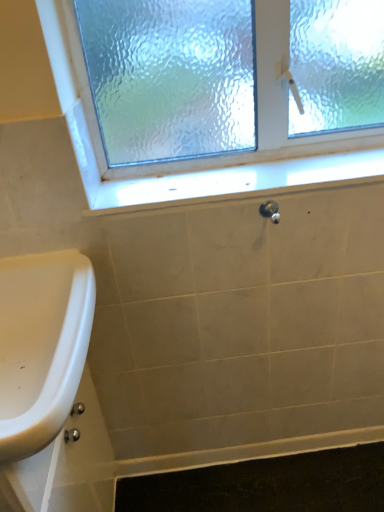
Question: Is frosted glass window at upper center at the back of white glossy sink at lower left?

Choices:
 (A) yes
 (B) no

Answer: (B)

Question: Would you say white glossy sink at lower left is outside frosted glass window at upper center?

Choices:
 (A) yes
 (B) no

Answer: (A)

Question: From a real-world perspective, does white glossy sink at lower left sit lower than frosted glass window at upper center?

Choices:
 (A) no
 (B) yes

Answer: (B)

Question: Can you confirm if white glossy sink at lower left is bigger than frosted glass window at upper center?

Choices:
 (A) no
 (B) yes

Answer: (A)

Question: Does white glossy sink at lower left have a lesser width compared to frosted glass window at upper center?

Choices:
 (A) yes
 (B) no

Answer: (B)

Question: From a real-world perspective, is satin nickel knob at center physically located above or below white glossy sink at lower left?

Choices:
 (A) below
 (B) above

Answer: (B)

Question: Is point (279, 219) closer or farther from the camera than point (57, 266)?

Choices:
 (A) farther
 (B) closer

Answer: (A)

Question: From their relative heights in the image, would you say satin nickel knob at center is taller or shorter than white glossy sink at lower left?

Choices:
 (A) tall
 (B) short

Answer: (B)

Question: Is satin nickel knob at center inside or outside of white glossy sink at lower left?

Choices:
 (A) outside
 (B) inside

Answer: (A)

Question: Is white glossy sink at lower left inside the boundaries of frosted glass window at upper center, or outside?

Choices:
 (A) inside
 (B) outside

Answer: (B)

Question: Relative to frosted glass window at upper center, is white glossy sink at lower left in front or behind?

Choices:
 (A) behind
 (B) front

Answer: (B)

Question: Does point (6, 388) appear closer or farther from the camera than point (337, 181)?

Choices:
 (A) farther
 (B) closer

Answer: (B)

Question: Would you say white glossy sink at lower left is to the left or to the right of frosted glass window at upper center in the picture?

Choices:
 (A) left
 (B) right

Answer: (A)

Question: From a real-world perspective, is satin nickel knob at center above or below frosted glass window at upper center?

Choices:
 (A) above
 (B) below

Answer: (B)

Question: In the image, is satin nickel knob at center positioned in front of or behind frosted glass window at upper center?

Choices:
 (A) front
 (B) behind

Answer: (B)